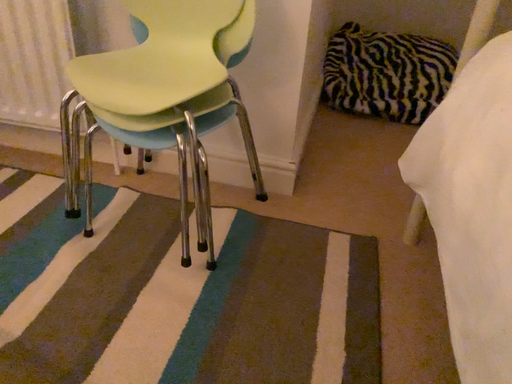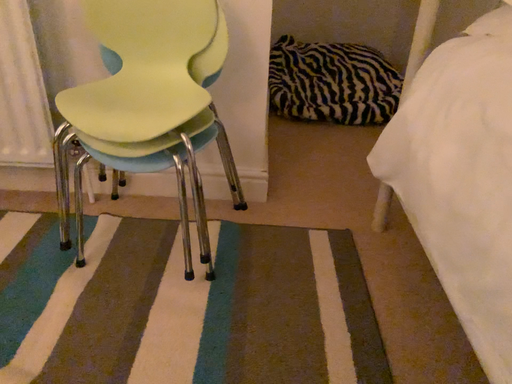
Question: How did the camera likely rotate when shooting the video?

Choices:
 (A) rotated right
 (B) rotated left

Answer: (A)